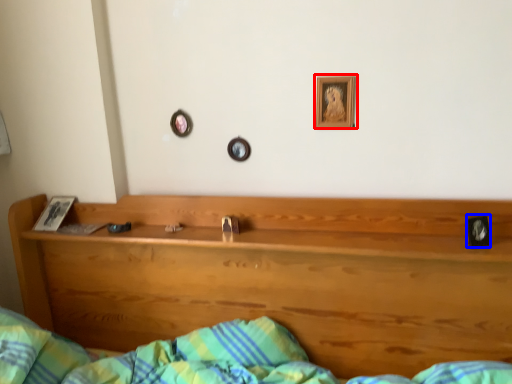
Question: Which object appears closest to the camera in this image, picture frame (highlighted by a red box) or picture frame (highlighted by a blue box)?

Choices:
 (A) picture frame
 (B) picture frame

Answer: (B)